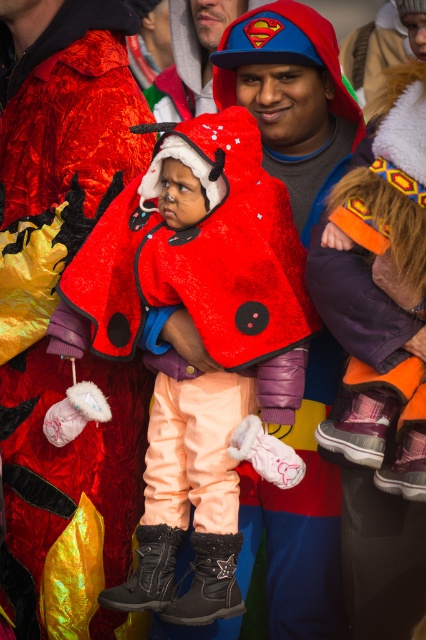
Question: Which object appears closest to the camera in this image?

Choices:
 (A) velvet-like orange pants at lower center
 (B) fuzzy red coat at center
 (C) velvet-like red cape at center

Answer: (A)

Question: Can you confirm if fuzzy red coat at center is bigger than velvet-like orange pants at lower center?

Choices:
 (A) no
 (B) yes

Answer: (B)

Question: Which object is positioned farthest from the velvet-like orange pants at lower center?

Choices:
 (A) fuzzy red coat at center
 (B) velvet-like red cape at center

Answer: (B)

Question: Which point appears farthest from the camera in this image?

Choices:
 (A) (65, 248)
 (B) (420, 424)

Answer: (A)

Question: Can you confirm if fuzzy red coat at center is thinner than velvet-like orange pants at lower center?

Choices:
 (A) yes
 (B) no

Answer: (B)

Question: Is velvet-like red cape at center wider than velvet-like orange pants at lower center?

Choices:
 (A) yes
 (B) no

Answer: (B)